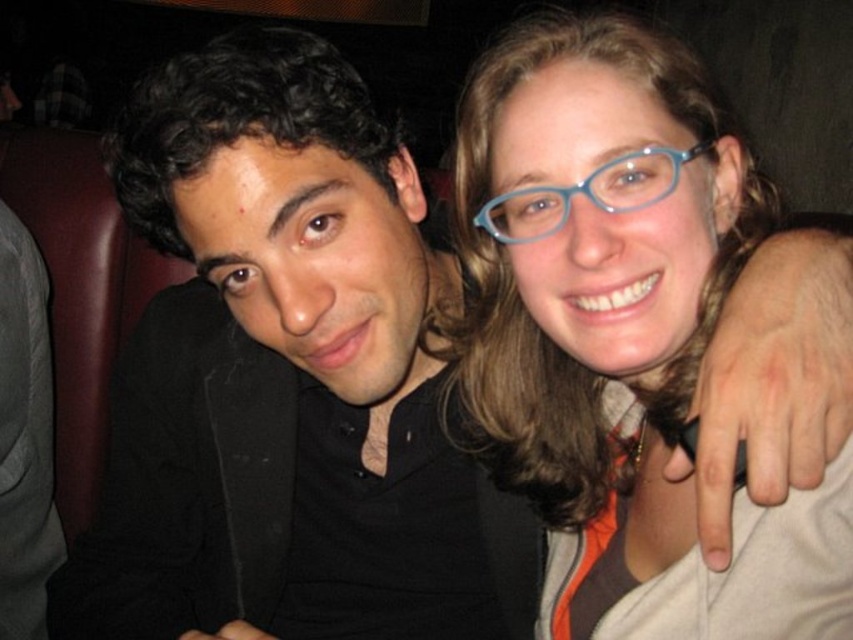
Locate an element on the screen. Image resolution: width=853 pixels, height=640 pixels. blue plastic glasses at upper right is located at coordinates (624, 333).

Which is in front, point (648, 122) or point (506, 211)?

Point (648, 122) is more forward.

Is point (465, 172) more distant than point (608, 209)?

Yes.

Identify the location of blue plastic glasses at upper right. The width and height of the screenshot is (853, 640). (624, 333).

Who is positioned more to the right, black matte jacket at left or blue plastic glasses at upper right?

Positioned to the right is blue plastic glasses at upper right.

What do you see at coordinates (288, 380) in the screenshot?
I see `black matte jacket at left` at bounding box center [288, 380].

Who is more distant from viewer, (212,340) or (503,358)?

The point (212,340) is more distant.

You are a GUI agent. You are given a task and a screenshot of the screen. Output one action in this format:
    pyautogui.click(x=<x>, y=<y>)
    Task: Click on the black matte jacket at left
    
    Given the screenshot: What is the action you would take?
    pyautogui.click(x=288, y=380)

Does black matte jacket at left lie in front of blue plastic glasses at upper center?

That is False.

The image size is (853, 640). What do you see at coordinates (288, 380) in the screenshot? I see `black matte jacket at left` at bounding box center [288, 380].

Is point (428, 365) positioned in front of point (674, 177)?

That is False.

Identify the location of black matte jacket at left. The height and width of the screenshot is (640, 853). (288, 380).